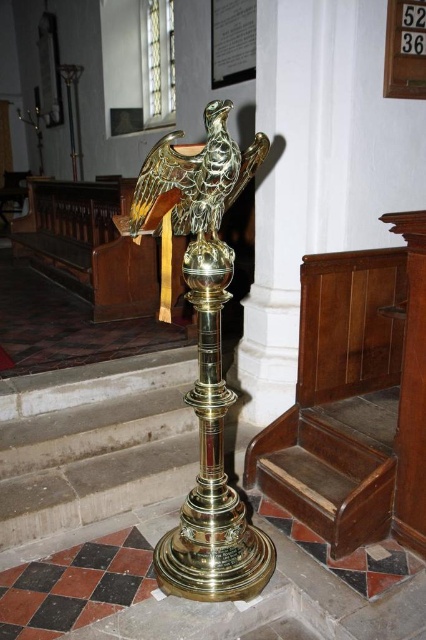
Question: Which point is farther to the camera?

Choices:
 (A) [255, 145]
 (B) [195, 540]

Answer: (B)

Question: In this image, where is polished brass lectern at center located relative to gold polished eagle at center?

Choices:
 (A) above
 (B) below

Answer: (B)

Question: Is polished brass lectern at center below gold polished eagle at center?

Choices:
 (A) yes
 (B) no

Answer: (A)

Question: Is the position of polished brass lectern at center more distant than that of gold polished eagle at center?

Choices:
 (A) no
 (B) yes

Answer: (B)